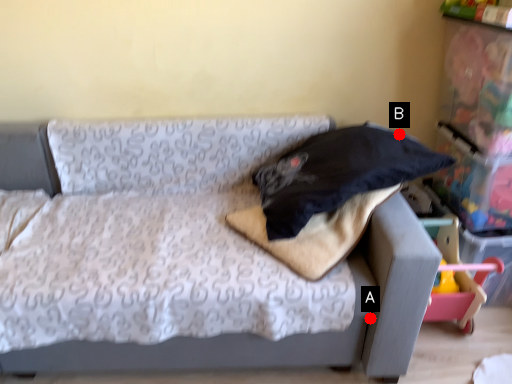
Question: Two points are circled on the image, labeled by A and B beside each circle. Among these points, which one is farthest from the camera?

Choices:
 (A) A is further
 (B) B is further

Answer: (B)